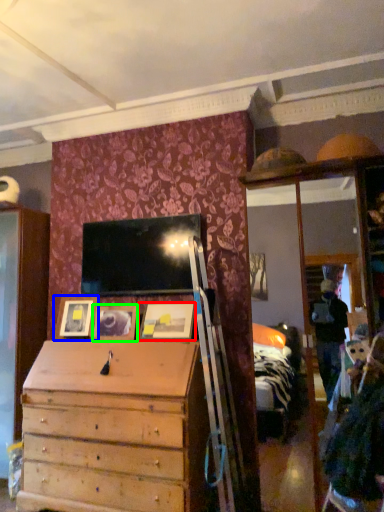
Question: Considering the real-world distances, which object is farthest from picture frame (highlighted by a red box)? picture frame (highlighted by a blue box) or picture frame (highlighted by a green box)?

Choices:
 (A) picture frame
 (B) picture frame

Answer: (A)